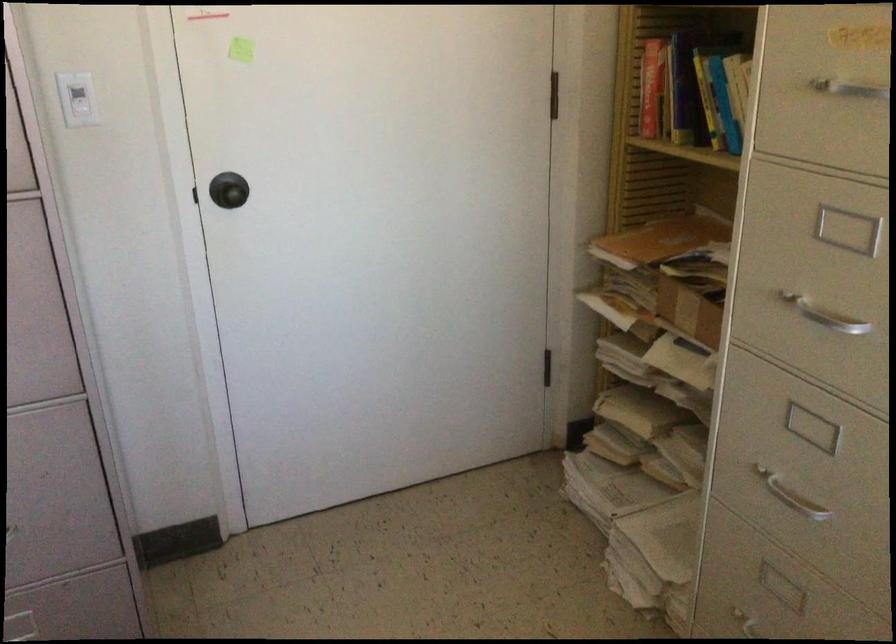
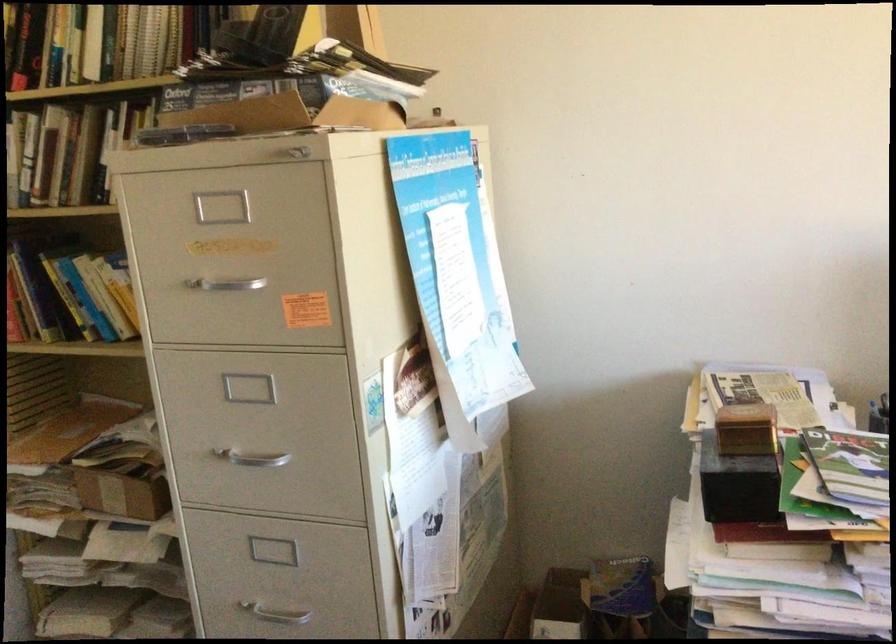
Where in the second image is the point corresponding to [672,96] from the first image?

(27, 301)